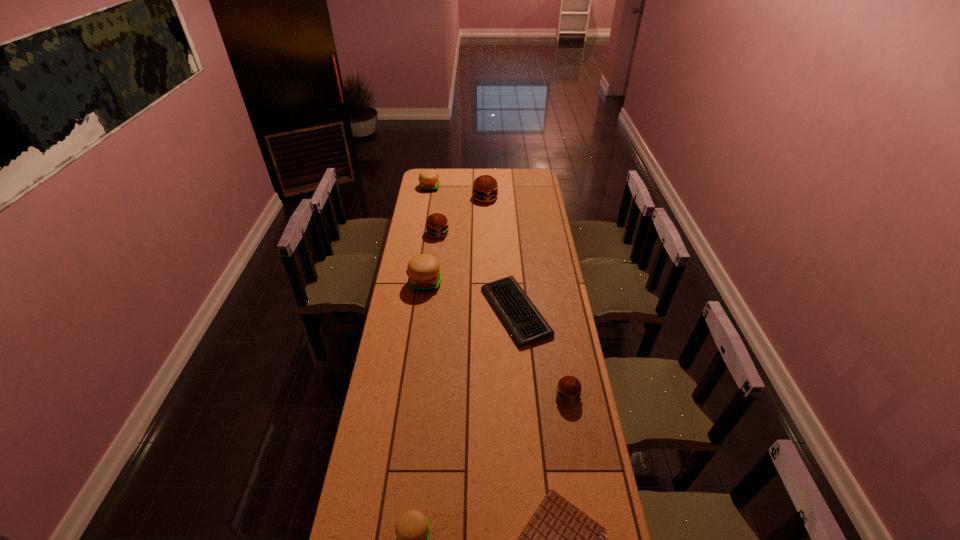
Locate an element on the screen. The height and width of the screenshot is (540, 960). vacant space at the far edge is located at coordinates (498, 178).

I want to click on vacant space at the left edge of the desktop, so click(x=386, y=381).

Find the location of a particular element. The width and height of the screenshot is (960, 540). vacant position at the right edge of the desktop is located at coordinates (539, 200).

In order to click on vacant space at the far right corner in this screenshot , I will do pos(516,168).

You are a GUI agent. You are given a task and a screenshot of the screen. Output one action in this format:
    pyautogui.click(x=<x>, y=<y>)
    Task: Click on the free point between the fifth farthest hamburger and the biggest beige hamburger
    
    Given the screenshot: What is the action you would take?
    pyautogui.click(x=496, y=339)

Identify the location of free space between the leftmost brown hamburger and the biggest brown hamburger. The image size is (960, 540). (462, 216).

At what (x,y) coordinates should I click in order to perform the action: click on vacant space in between the computer keyboard and the rightmost hamburger. Please return your answer as a coordinate pair (x, y). Looking at the image, I should click on (541, 354).

In order to click on vacant region between the third nearest hamburger and the second brown hamburger from left to right in this screenshot , I will do `click(455, 241)`.

At what (x,y) coordinates should I click in order to perform the action: click on free space that is in between the second farthest beige hamburger and the second nearest hamburger. Please return your answer as a coordinate pair (x, y). This screenshot has width=960, height=540. Looking at the image, I should click on (496, 339).

Identify the location of free point between the second shortest object and the second smallest brown hamburger. This screenshot has height=540, width=960. [x=477, y=273].